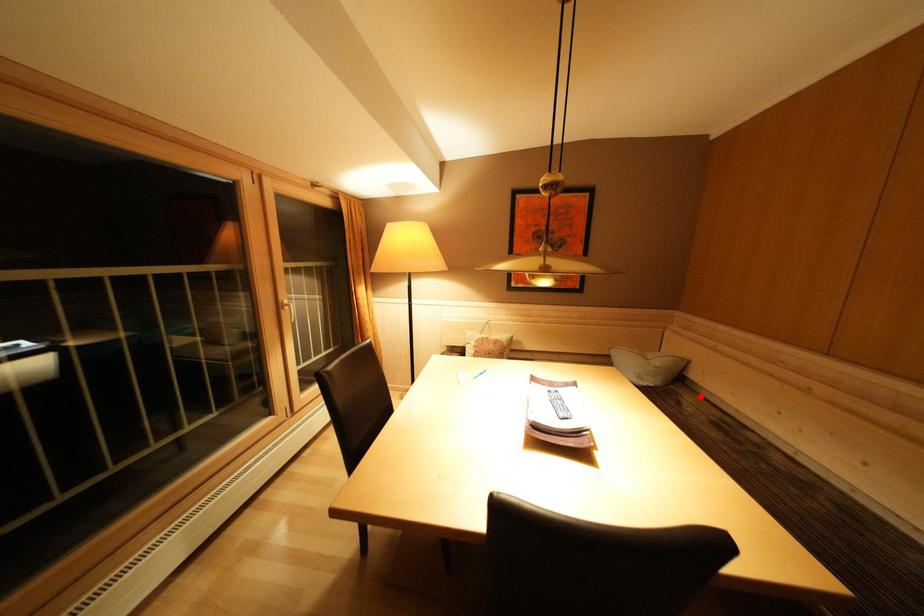
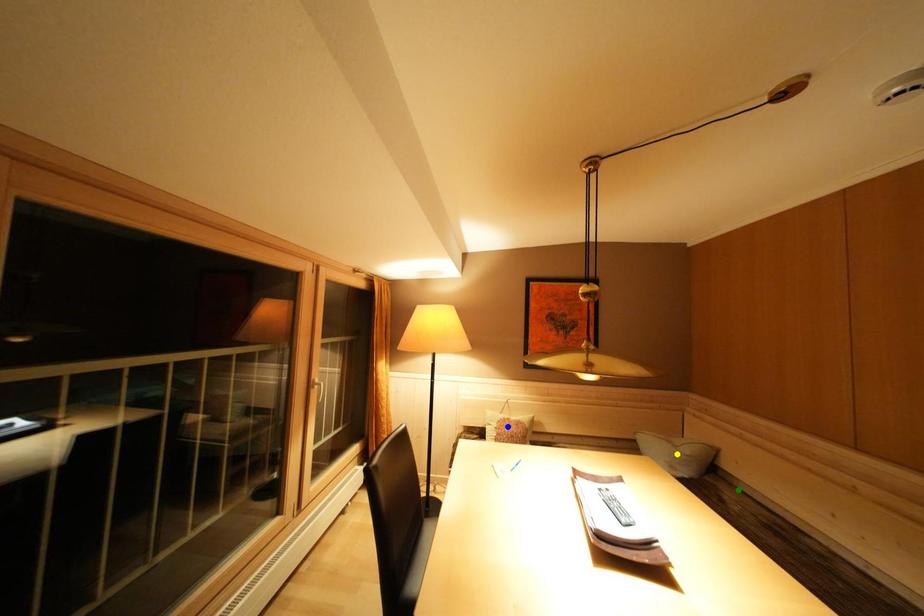
Question: I am providing you with two images of the same scene from different viewpoints. A red point is marked on the first image. You are given multiple points on the second image. Which mark in image 2 goes with the point in image 1?

Choices:
 (A) green point
 (B) blue point
 (C) yellow point

Answer: (A)